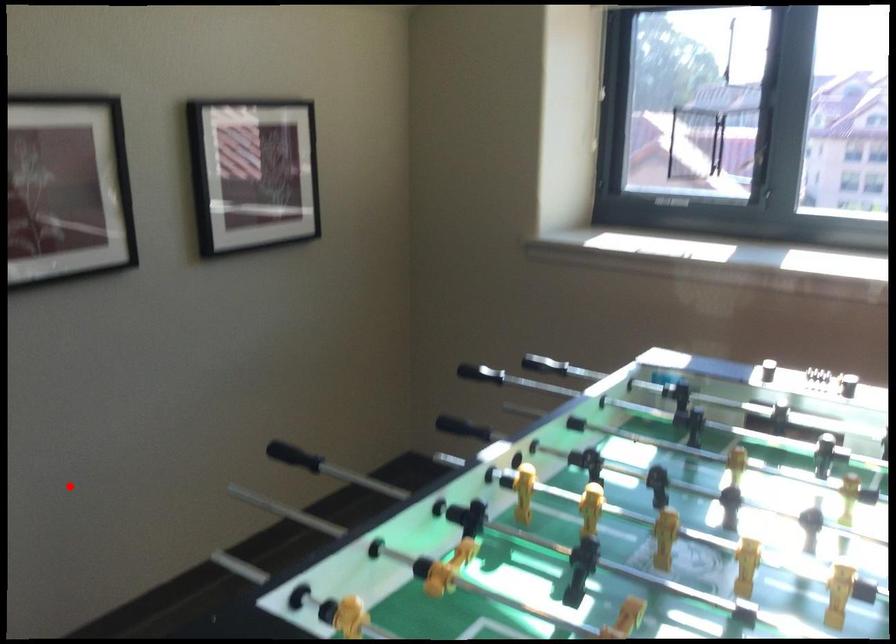
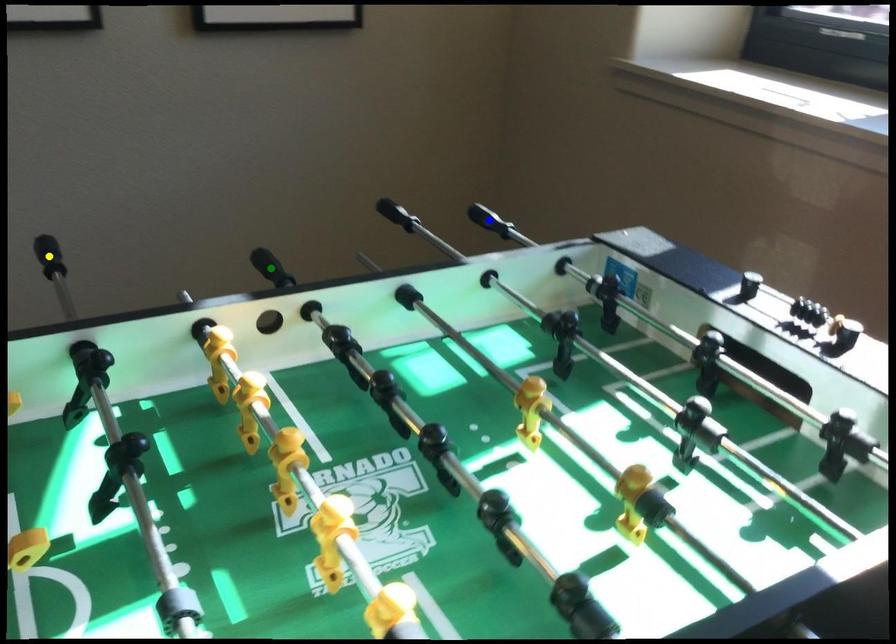
Question: I am providing you with two images of the same scene from different viewpoints. A red point is marked on the first image. You are given multiple points on the second image. Which point in image 2 is actually the same real-world point as the red point in image 1?

Choices:
 (A) yellow point
 (B) blue point
 (C) green point

Answer: (A)